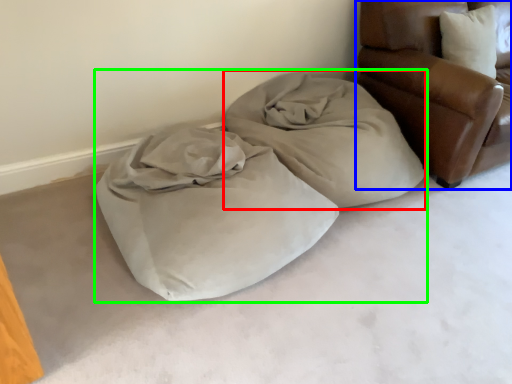
Question: Which object is the farthest from cloth (highlighted by a red box)? Choose among these: furniture (highlighted by a blue box) or bed (highlighted by a green box).

Choices:
 (A) furniture
 (B) bed

Answer: (A)